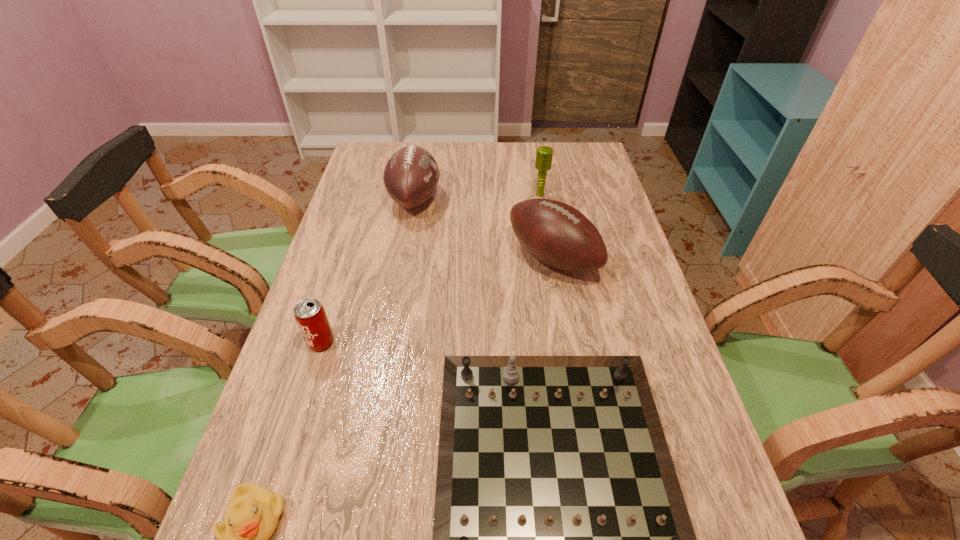
This screenshot has width=960, height=540. What are the coordinates of `empty space between the left football (American) and the microphone` in the screenshot? It's located at (x=477, y=197).

Find the location of a particular element. unoccupied area between the farther football (American) and the microphone is located at coordinates (477, 197).

You are a GUI agent. You are given a task and a screenshot of the screen. Output one action in this format:
    pyautogui.click(x=<x>, y=<y>)
    Task: Click on the object that is the second closest to the chessboard
    This screenshot has width=960, height=540.
    Given the screenshot: What is the action you would take?
    pyautogui.click(x=253, y=512)

Find the location of a particular element. object that is the fifth closest to the microphone is located at coordinates (253, 512).